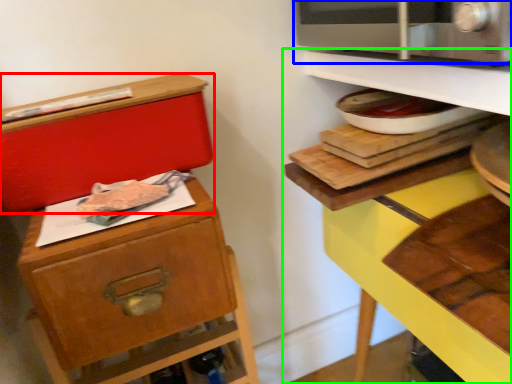
Question: Considering the real-world distances, which object is farthest from box (highlighted by a red box)? microwave oven (highlighted by a blue box) or shelf (highlighted by a green box)?

Choices:
 (A) microwave oven
 (B) shelf

Answer: (A)